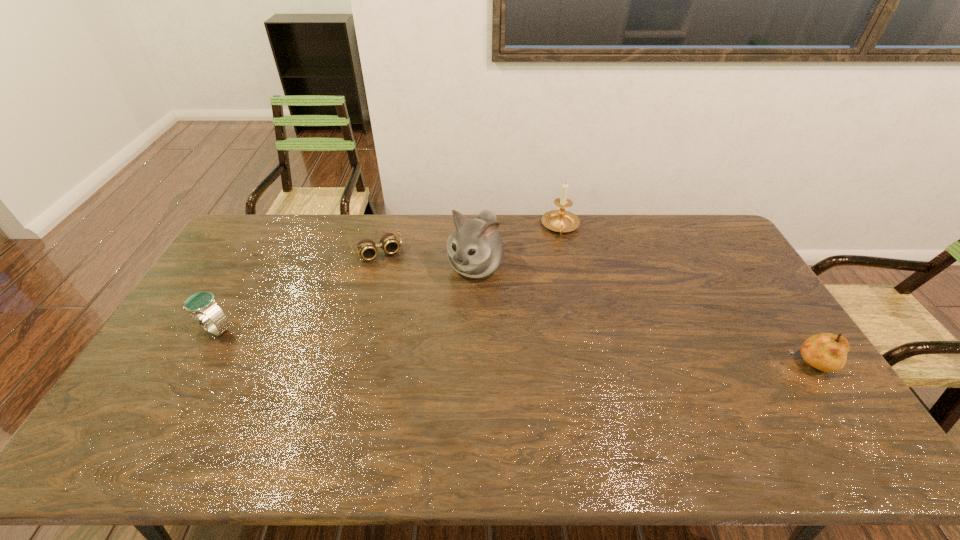
Locate an element on the screen. The image size is (960, 540). free space located 0.370m with a handle on the side of the candle holder is located at coordinates (571, 315).

The width and height of the screenshot is (960, 540). Identify the location of hamster situated at the far edge. (475, 249).

The width and height of the screenshot is (960, 540). Identify the location of goggles located in the far edge section of the desktop. (367, 249).

Identify the location of candle holder located in the far edge section of the desktop. This screenshot has width=960, height=540. (561, 220).

I want to click on object located at the left edge, so click(x=202, y=307).

Locate an element on the screen. This screenshot has height=540, width=960. object present at the right edge is located at coordinates (827, 352).

You are a GUI agent. You are given a task and a screenshot of the screen. Output one action in this format:
    pyautogui.click(x=<x>, y=<y>)
    Task: Click on the vacant space at the far edge
    This screenshot has height=540, width=960.
    Given the screenshot: What is the action you would take?
    [x=529, y=238]

In the image, there is a desktop. At what (x,y) coordinates should I click in order to perform the action: click on vacant space at the near edge. Please return your answer as a coordinate pair (x, y). Looking at the image, I should click on (395, 407).

At what (x,y) coordinates should I click in order to perform the action: click on vacant space at the left edge. Please return your answer as a coordinate pair (x, y). Looking at the image, I should click on (220, 340).

The height and width of the screenshot is (540, 960). In the image, there is a desktop. What are the coordinates of `free space at the right edge` in the screenshot? It's located at (747, 328).